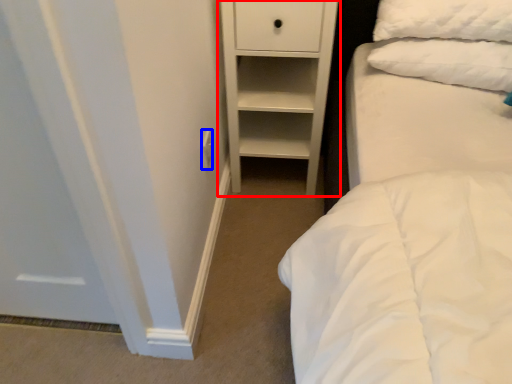
Question: Which object appears farthest to the camera in this image, chest of drawers (highlighted by a red box) or electric outlet (highlighted by a blue box)?

Choices:
 (A) chest of drawers
 (B) electric outlet

Answer: (B)